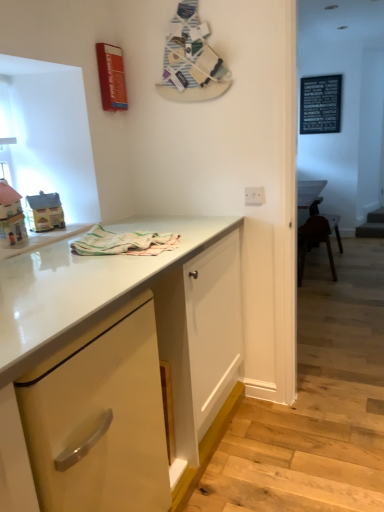
Question: Which direction should I rotate to face matte yellow cabinet at center, the second cabinetry when ordered from back to front, — up or down?

Choices:
 (A) down
 (B) up

Answer: (A)

Question: Is matte yellow toy house at left, placed as the first toy when sorted from front to back, positioned behind matte yellow house at left, the first toy from the back?

Choices:
 (A) yes
 (B) no

Answer: (B)

Question: Is matte yellow toy house at left, placed as the first toy when sorted from front to back, at the right side of matte yellow house at left, the first toy from the back?

Choices:
 (A) yes
 (B) no

Answer: (B)

Question: Is matte yellow toy house at left, which is the second toy from back to front, facing away from matte yellow house at left, the 2th toy positioned from the front?

Choices:
 (A) yes
 (B) no

Answer: (B)

Question: From the image's perspective, is matte yellow toy house at left, placed as the first toy when sorted from front to back, under matte yellow house at left, the 2th toy positioned from the front?

Choices:
 (A) yes
 (B) no

Answer: (A)

Question: Is the surface of matte yellow toy house at left, which is the second toy from back to front, in direct contact with matte yellow house at left, the 2th toy positioned from the front?

Choices:
 (A) no
 (B) yes

Answer: (B)

Question: Considering the relative positions of matte yellow toy house at left, placed as the first toy when sorted from front to back, and matte yellow house at left, the 2th toy positioned from the front, in the image provided, is matte yellow toy house at left, placed as the first toy when sorted from front to back, to the left of matte yellow house at left, the 2th toy positioned from the front, from the viewer's perspective?

Choices:
 (A) yes
 (B) no

Answer: (A)

Question: Is matte yellow cabinet at center, the second cabinetry when ordered from back to front, turned away from white glossy electric outlet at upper center?

Choices:
 (A) no
 (B) yes

Answer: (A)

Question: Does matte yellow cabinet at center, the second cabinetry when ordered from back to front, appear on the left side of white glossy electric outlet at upper center?

Choices:
 (A) yes
 (B) no

Answer: (A)

Question: Can you confirm if matte yellow cabinet at center, which is the first cabinetry from front to back, is bigger than white glossy electric outlet at upper center?

Choices:
 (A) no
 (B) yes

Answer: (B)

Question: From a real-world perspective, is matte yellow cabinet at center, the second cabinetry when ordered from back to front, positioned over white glossy electric outlet at upper center based on gravity?

Choices:
 (A) yes
 (B) no

Answer: (B)

Question: From a real-world perspective, does matte yellow cabinet at center, which is the first cabinetry from front to back, sit lower than white glossy electric outlet at upper center?

Choices:
 (A) no
 (B) yes

Answer: (B)

Question: Could you tell me if matte yellow cabinet at center, the second cabinetry when ordered from back to front, is turned towards white glossy electric outlet at upper center?

Choices:
 (A) no
 (B) yes

Answer: (A)

Question: Are matte yellow house at left, the first toy from the back, and matte yellow cabinet at center, which is the first cabinetry from front to back, making contact?

Choices:
 (A) yes
 (B) no

Answer: (B)